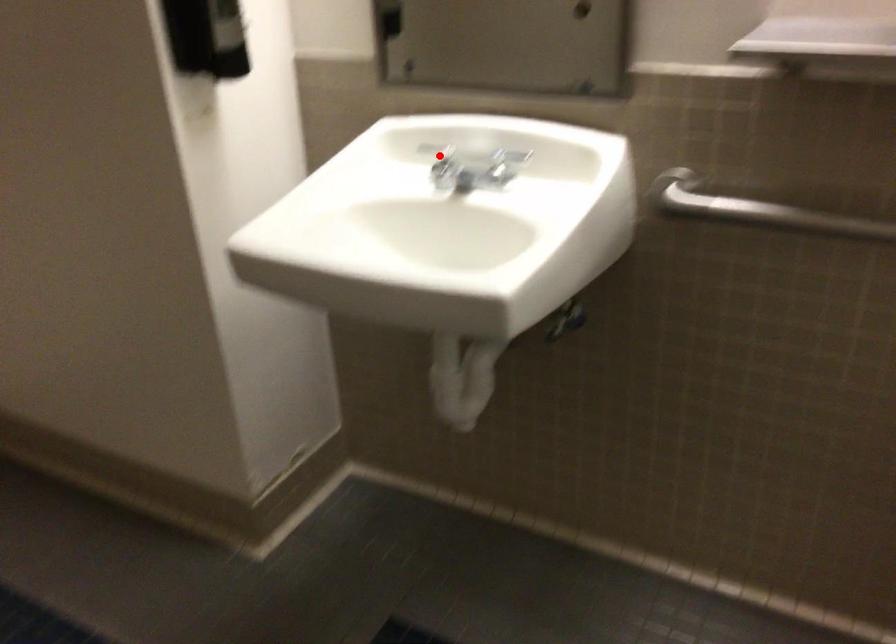
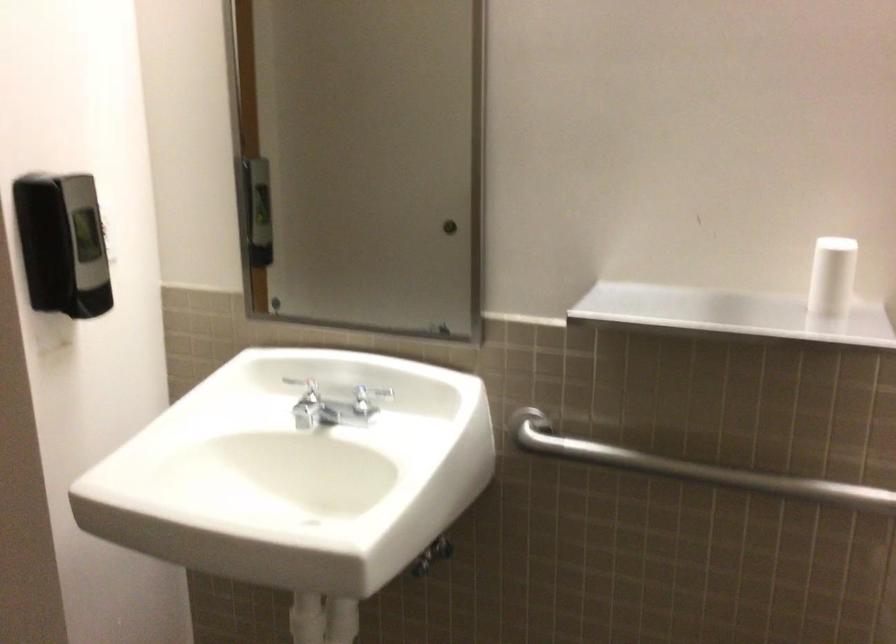
The point at the highlighted location is marked in the first image. Where is the corresponding point in the second image?

(305, 389)